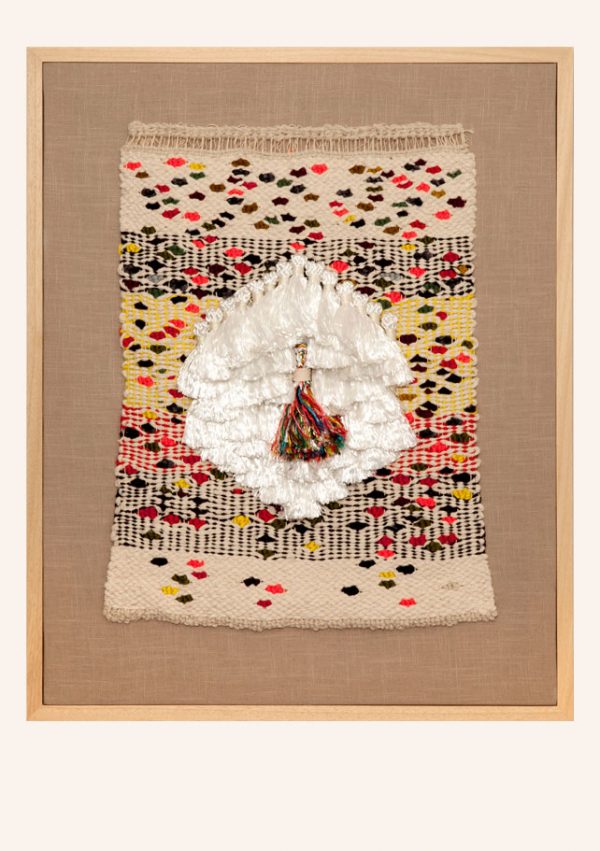
Where is `art`? The image size is (600, 851). art is located at coordinates (411, 546).